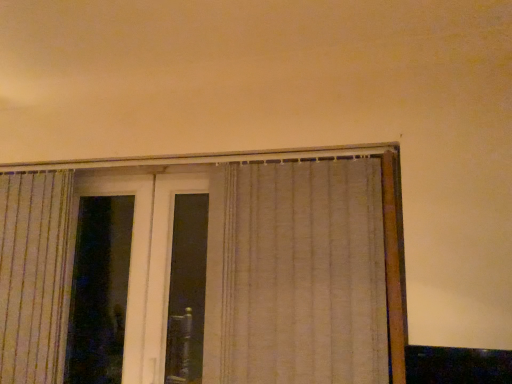
What do you see at coordinates (298, 275) in the screenshot? I see `beige textured curtain at center` at bounding box center [298, 275].

In order to face beige textured curtain at center, should I rotate leftwards or rightwards?

To face it directly, rotate right by 0.225 degrees.

Where is `beige textured curtain at center`? beige textured curtain at center is located at coordinates (298, 275).

Describe the element at coordinates (147, 260) in the screenshot. The image size is (512, 384). I see `transparent glass screen door at left` at that location.

Identify the location of transparent glass screen door at left. (147, 260).

The height and width of the screenshot is (384, 512). What are the coordinates of `beige textured curtain at center` in the screenshot? It's located at (298, 275).

Which object is positioned more to the right, beige textured curtain at center or transparent glass screen door at left?

Positioned to the right is beige textured curtain at center.

Is the depth of beige textured curtain at center less than that of transparent glass screen door at left?

That is True.

Is point (239, 246) in front of point (151, 314)?

Yes, it is in front of point (151, 314).

From the image's perspective, which one is positioned higher, beige textured curtain at center or transparent glass screen door at left?

beige textured curtain at center is shown above in the image.

From a real-world perspective, is beige textured curtain at center above or below transparent glass screen door at left?

beige textured curtain at center is situated higher than transparent glass screen door at left in the real world.

Does beige textured curtain at center have a greater width compared to transparent glass screen door at left?

Yes, beige textured curtain at center is wider than transparent glass screen door at left.

Does beige textured curtain at center have a lesser height compared to transparent glass screen door at left?

Yes, beige textured curtain at center is shorter than transparent glass screen door at left.

Is beige textured curtain at center bigger or smaller than transparent glass screen door at left?

Clearly, beige textured curtain at center is larger in size than transparent glass screen door at left.

Is beige textured curtain at center inside or outside of transparent glass screen door at left?

beige textured curtain at center is not enclosed by transparent glass screen door at left.

Is beige textured curtain at center directly adjacent to transparent glass screen door at left?

beige textured curtain at center and transparent glass screen door at left are not in contact.

Is beige textured curtain at center oriented away from transparent glass screen door at left?

beige textured curtain at center is not turned away from transparent glass screen door at left.

The width and height of the screenshot is (512, 384). Find the location of `screen door below the beige textured curtain at center (from a real-world perspective)`. screen door below the beige textured curtain at center (from a real-world perspective) is located at coordinates coord(147,260).

Does transparent glass screen door at left appear on the right side of beige textured curtain at center?

No.

Is transparent glass screen door at left in front of beige textured curtain at center?

No, it is behind beige textured curtain at center.

Considering the points (144, 353) and (302, 341), which point is behind, point (144, 353) or point (302, 341)?

The point (144, 353) is behind.

From the image's perspective, is transparent glass screen door at left above or below beige textured curtain at center?

transparent glass screen door at left is below beige textured curtain at center.

From a real-world perspective, is transparent glass screen door at left on top of beige textured curtain at center?

Incorrect, from a real-world perspective, transparent glass screen door at left is lower than beige textured curtain at center.

Which of these two, transparent glass screen door at left or beige textured curtain at center, is wider?

Wider between the two is beige textured curtain at center.

Which of these two, transparent glass screen door at left or beige textured curtain at center, stands taller?

With more height is transparent glass screen door at left.

Based on their sizes in the image, would you say transparent glass screen door at left is bigger or smaller than beige textured curtain at center?

transparent glass screen door at left is smaller than beige textured curtain at center.

Can we say transparent glass screen door at left lies outside beige textured curtain at center?

That's correct, transparent glass screen door at left is outside of beige textured curtain at center.

Is transparent glass screen door at left in contact with beige textured curtain at center?

There is a gap between transparent glass screen door at left and beige textured curtain at center.

Is transparent glass screen door at left oriented towards beige textured curtain at center?

No, transparent glass screen door at left is not aimed at beige textured curtain at center.

What's the angular difference between transparent glass screen door at left and beige textured curtain at center's facing directions?

The angle between the facing direction of transparent glass screen door at left and the facing direction of beige textured curtain at center is 0.183 degrees.

How far apart are transparent glass screen door at left and beige textured curtain at center?

The distance of transparent glass screen door at left from beige textured curtain at center is 21.38 inches.

I want to click on screen door behind the beige textured curtain at center, so click(147, 260).

Locate an element on the screen. The image size is (512, 384). screen door located below the beige textured curtain at center (from the image's perspective) is located at coordinates (147, 260).

Image resolution: width=512 pixels, height=384 pixels. What are the coordinates of `curtain that is on the right side of transparent glass screen door at left` in the screenshot? It's located at (298, 275).